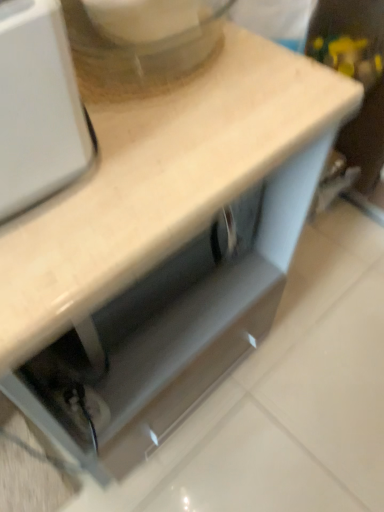
The height and width of the screenshot is (512, 384). Identify the location of free point above white matte countertop at upper center (from a real-world perspective). (162, 123).